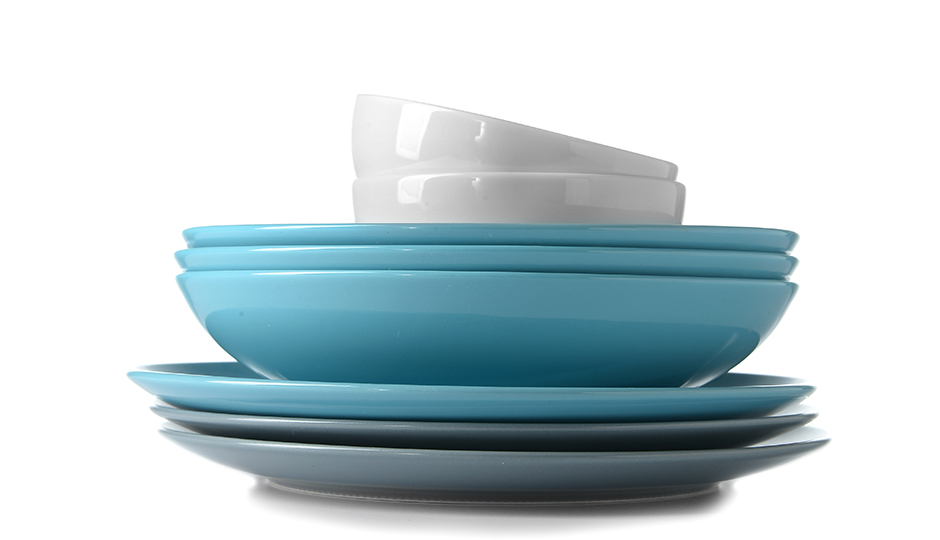
At what (x,y) coordinates should I click in order to perform the action: click on teal dishes. Please return your answer as a coordinate pair (x, y). Looking at the image, I should click on [556, 235], [544, 259], [527, 297], [490, 401].